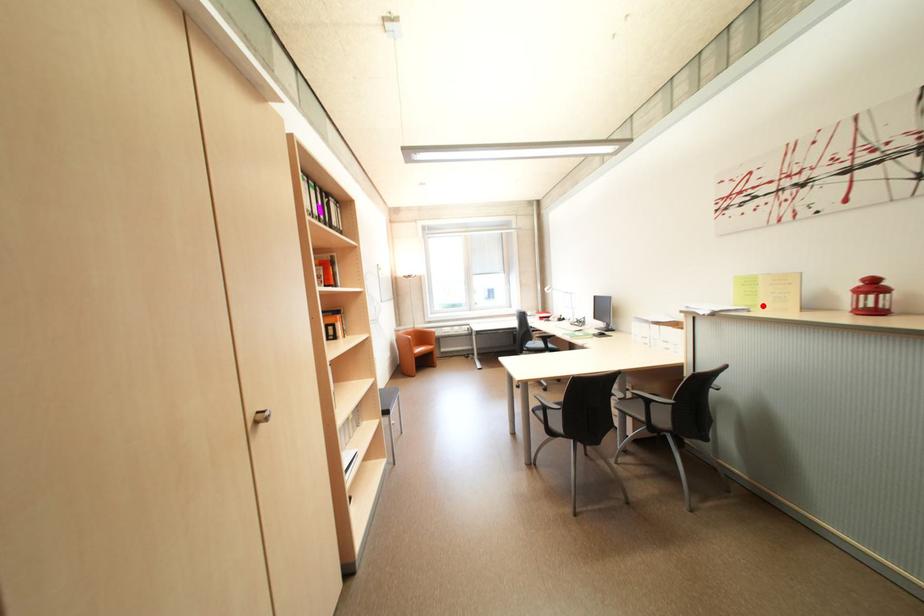
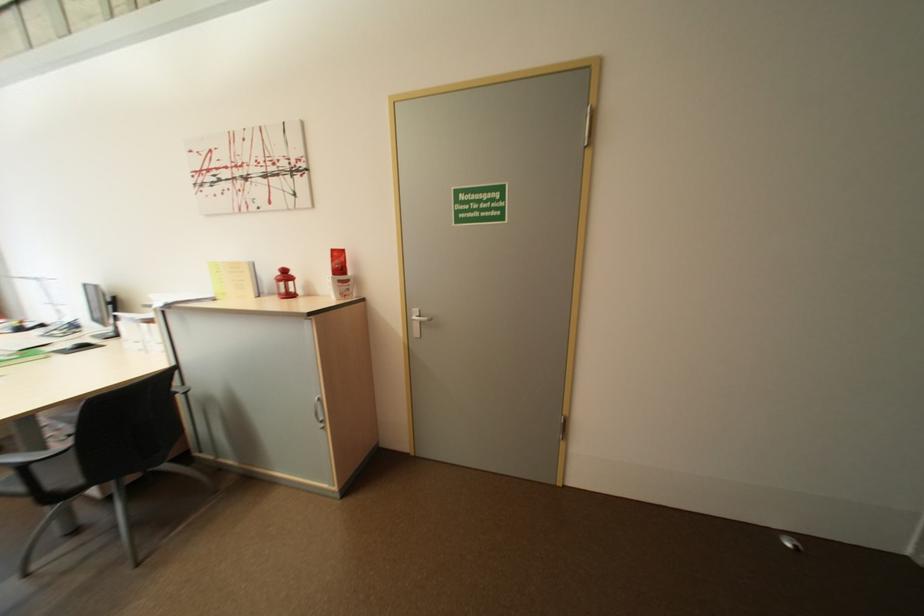
Find the pixel in the second image that matches the highlighted location in the first image.

(234, 294)